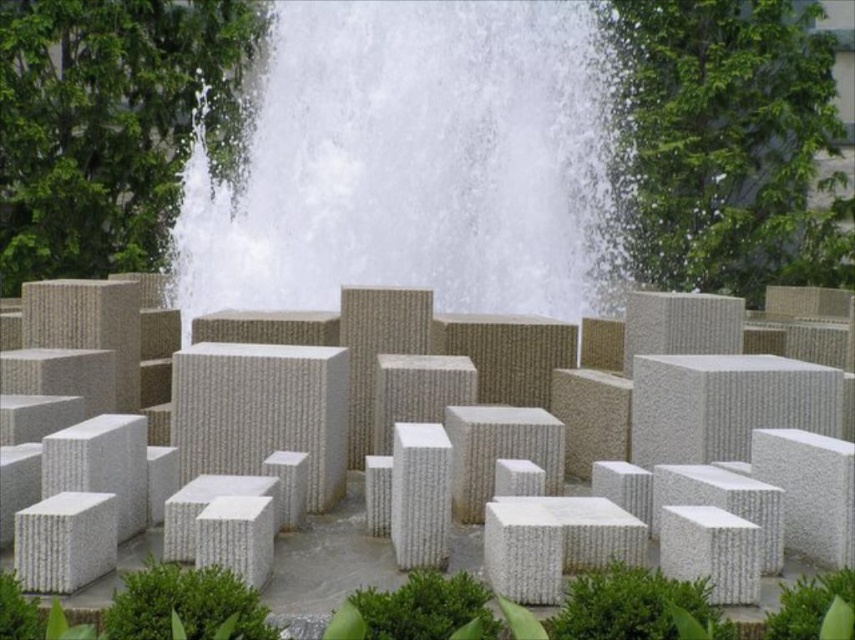
From the picture: You are standing in front of the fountain installation and want to take a photo of the white textured blocks at center without the white textured water at center obstructing the view. Is this possible based on their positions?

The white textured blocks at center are positioned behind the white textured water at center, so taking a clear photo of the blocks without the water obstructing the view would not be possible from your current vantage point.

You are standing in front of the fountain installation and want to place a small decorative statue between the white textured water at center and the white textured blocks at center. Given that the statue requires 1 meter of space, can you fit it between them?

The white textured water at center has a larger width than the white textured blocks at center. Since the statue requires 1 meter of space, it depends on the actual width difference between the two objects. However, the description only states that the water is wider, not by how much. Without specific measurements, we cannot confirm if the space is sufficient.